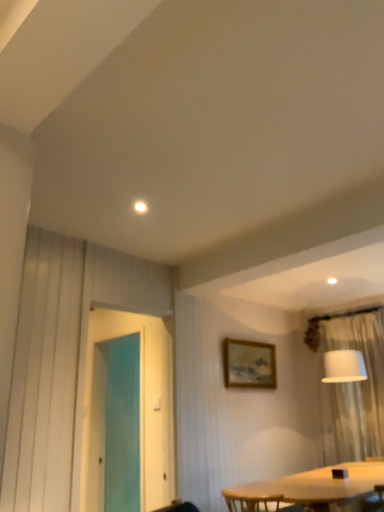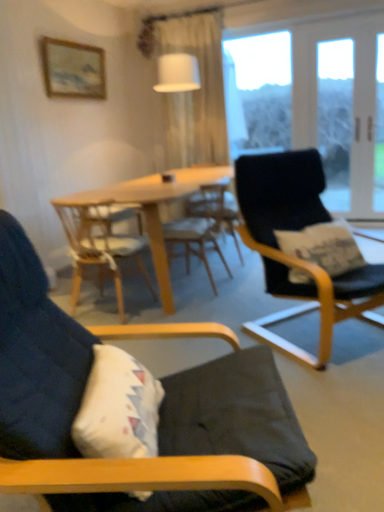
Question: How did the camera likely rotate when shooting the video?

Choices:
 (A) rotated upward
 (B) rotated downward

Answer: (B)